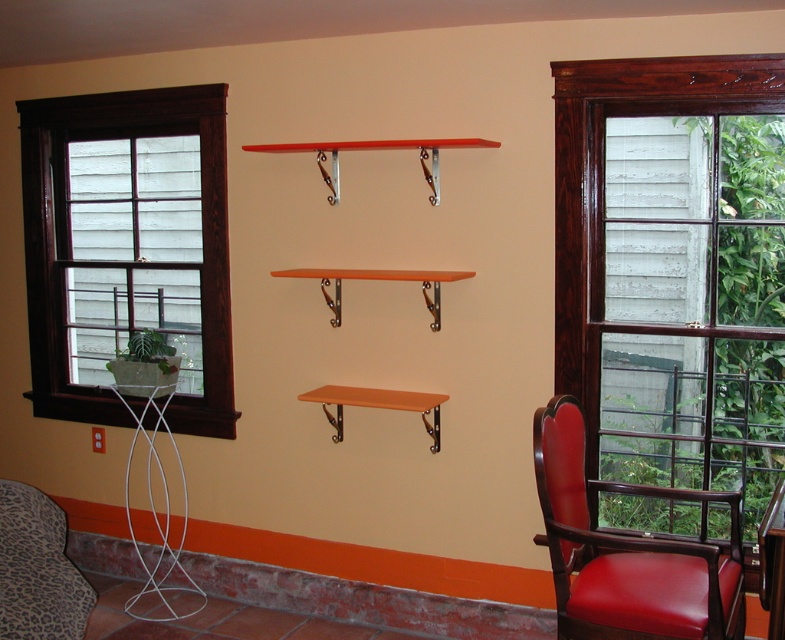
Question: Is matte orange shelf at center in front of orange wood shelf at center?

Choices:
 (A) yes
 (B) no

Answer: (B)

Question: Is wooden frame window at right wider than orange wood shelf at center?

Choices:
 (A) no
 (B) yes

Answer: (A)

Question: Estimate the real-world distances between objects in this image. Which object is closer to the orange matte shelf at center?

Choices:
 (A) brown wood window at left
 (B) matte orange shelf at center

Answer: (A)

Question: Which point is closer to the camera?

Choices:
 (A) leather armchair at right
 (B) orange wood shelf at center

Answer: (A)

Question: Which point is closer to the camera?

Choices:
 (A) wooden frame window at right
 (B) orange wood shelf at center

Answer: (A)

Question: Does wooden frame window at right appear on the right side of leather armchair at right?

Choices:
 (A) yes
 (B) no

Answer: (A)